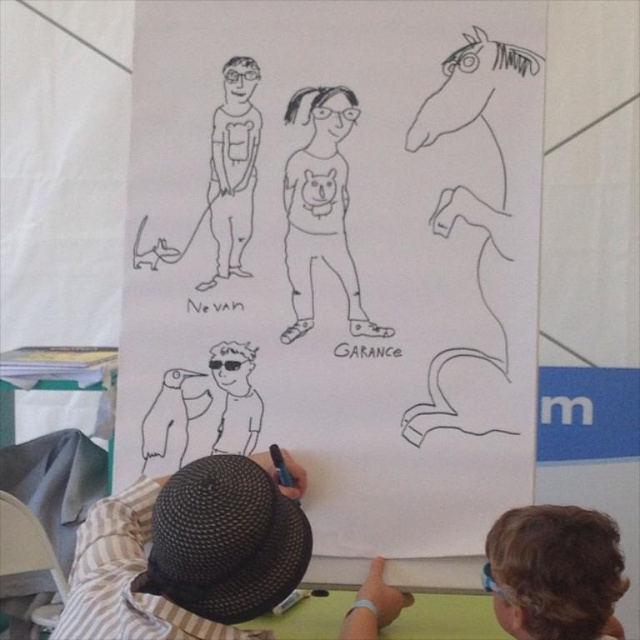
Based on the scene described, which object is located below the other? The brown hair at lower right or the black line drawing girl at center?

The brown hair at lower right is positioned under the black line drawing girl at center, so it is located below the other.

You are standing 4 feet away from the whiteboard. If you want to reach the point at coordinates point (358, 611) on the whiteboard, will you be able to reach it without moving closer?

The distance of point (358, 611) from camera is 3.82 feet, so you are currently 4 feet away from the whiteboard. Since 4 feet is farther than 3.82 feet, you need to move 0.18 feet closer to reach the point at point (358, 611).

What is located at the point with coordinates (556, 572) in the image?

The point at (556, 572) marks the location of the brown hair at lower right.